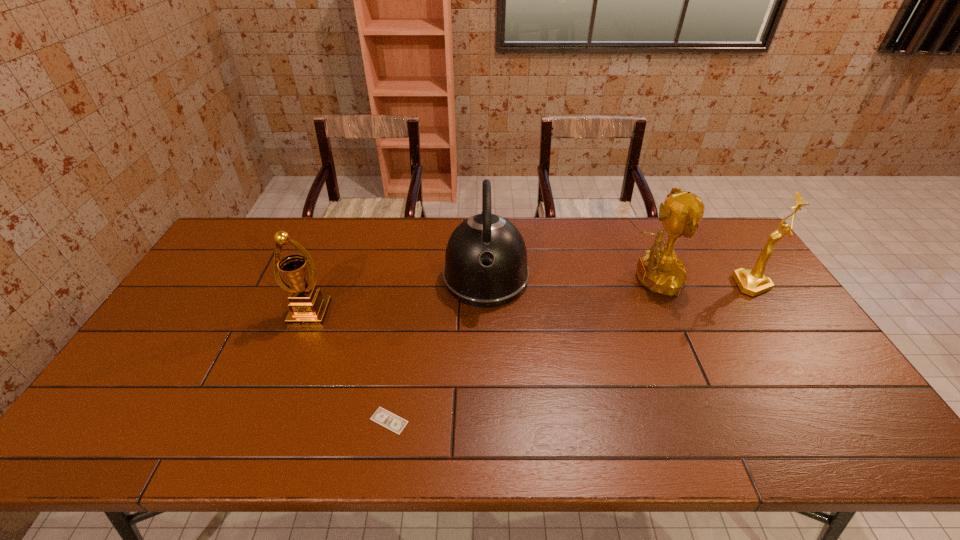
Find the location of a particular element. The image size is (960, 540). free spot located 0.180m on the front-facing side of the rightmost object is located at coordinates (678, 285).

Find the location of `free space located 0.340m on the front-facing side of the rightmost object`. free space located 0.340m on the front-facing side of the rightmost object is located at coordinates (627, 285).

Identify the location of free space located on the front-facing side of the rightmost object. This screenshot has height=540, width=960. (719, 285).

Locate an element on the screen. The image size is (960, 540). free space located on the front-facing side of the leftmost award is located at coordinates (264, 431).

The height and width of the screenshot is (540, 960). I want to click on free point located on the left of the second object from left to right, so click(x=263, y=421).

Identify the location of kettle located at the far edge. The height and width of the screenshot is (540, 960). (485, 266).

You are a GUI agent. You are given a task and a screenshot of the screen. Output one action in this format:
    pyautogui.click(x=<x>, y=<y>)
    Task: Click on the award at the far edge
    This screenshot has height=540, width=960.
    Given the screenshot: What is the action you would take?
    pyautogui.click(x=661, y=271)

I want to click on object that is at the near edge, so click(x=383, y=417).

Where is `object that is at the right edge`? The image size is (960, 540). object that is at the right edge is located at coordinates (753, 282).

Find the location of a particular element. The image size is (960, 540). vacant space at the far edge of the desktop is located at coordinates (615, 223).